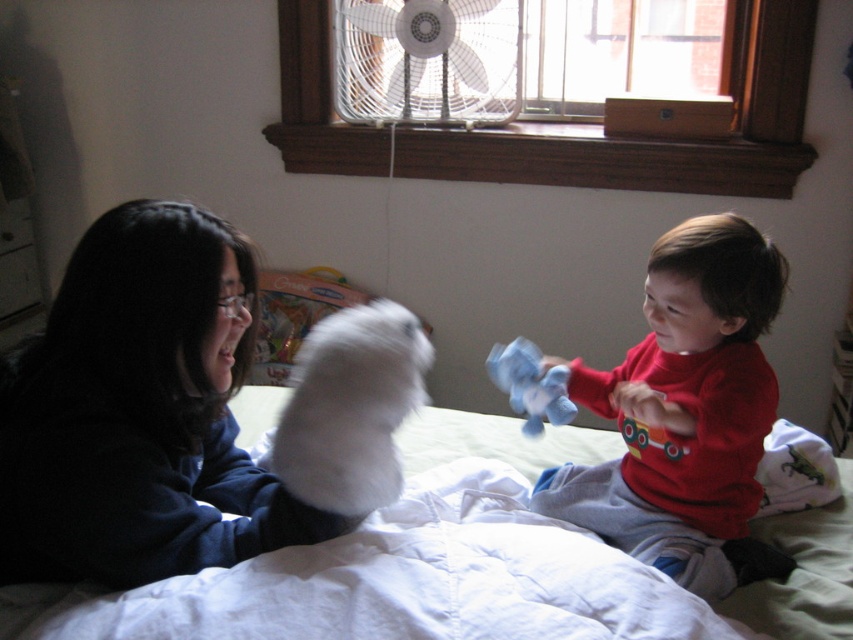
Question: Which is farther from the red cotton shirt at right?

Choices:
 (A) blue plush toy at center
 (B) white fluffy glove at upper left
 (C) white quilted bed at center

Answer: (B)

Question: Which point is farther from the camera taking this photo?

Choices:
 (A) (447, 577)
 (B) (743, 230)
 (C) (231, 252)
 (D) (525, 346)

Answer: (D)

Question: Among these points, which one is nearest to the camera?

Choices:
 (A) (434, 93)
 (B) (589, 572)
 (C) (524, 390)
 (D) (715, 400)

Answer: (B)

Question: Observing the image, what is the correct spatial positioning of white quilted bed at center in reference to white plastic fan at upper center?

Choices:
 (A) left
 (B) right

Answer: (B)

Question: Where is white quilted bed at center located in relation to white plastic fan at upper center in the image?

Choices:
 (A) left
 (B) right

Answer: (B)

Question: Is red cotton shirt at right above blue plush toy at center?

Choices:
 (A) yes
 (B) no

Answer: (A)